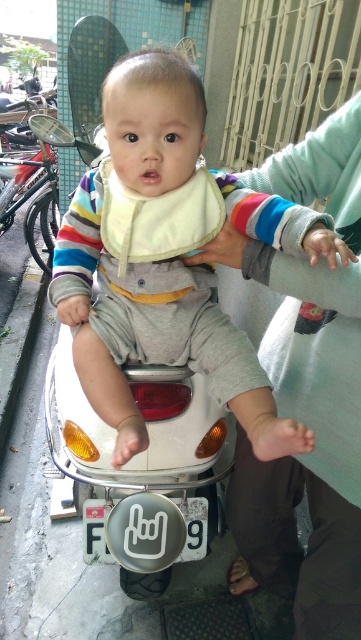
Who is more distant from viewer, (268, 444) or (358, 321)?

The point (268, 444) is behind.

At what (x,y) coordinates should I click in order to perform the action: click on matte yellow bib at center. Please return your answer as a coordinate pair (x, y). Looking at the image, I should click on (167, 257).